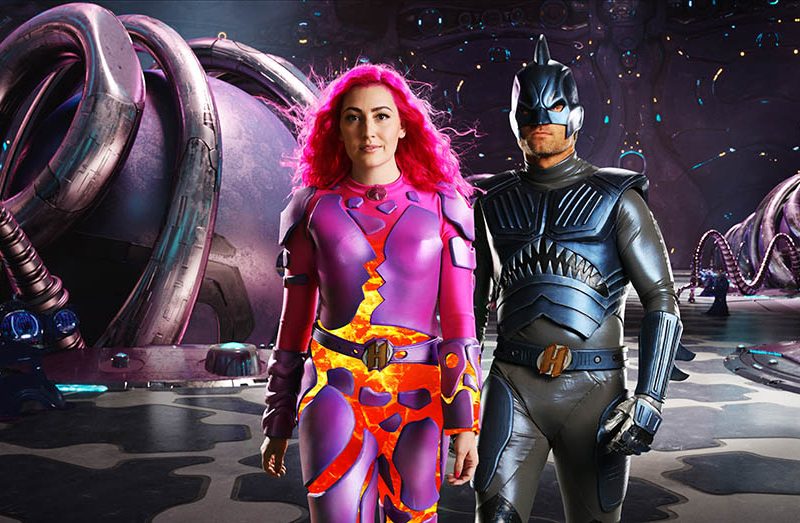
Identify the location of floor. The image size is (800, 523). (662, 469), (225, 497).